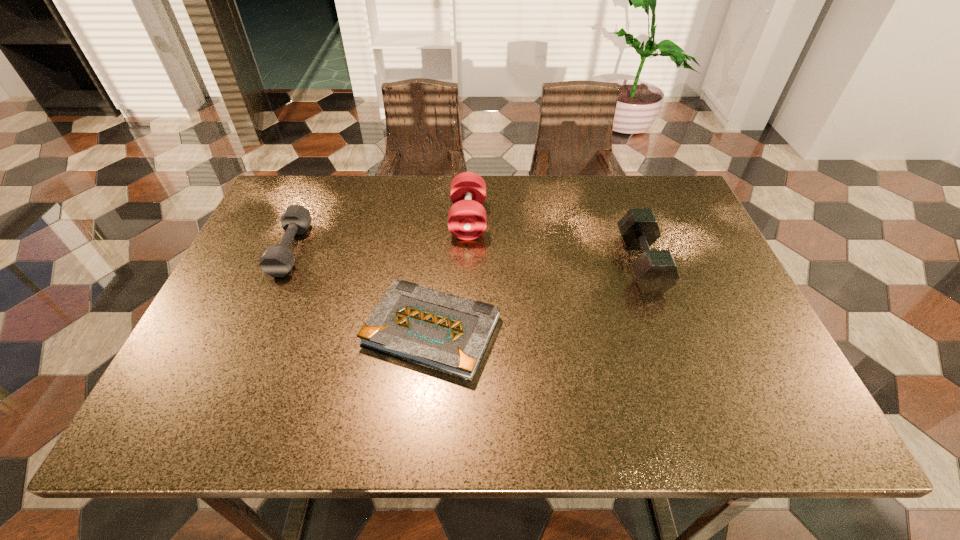
Find the location of a particular element. The image size is (960, 540). the second dumbbell from left to right is located at coordinates (467, 220).

Locate an element on the screen. the rightmost dumbbell is located at coordinates (656, 272).

What are the coordinates of `the leftmost object` in the screenshot? It's located at point(277,260).

Locate an element on the screen. The height and width of the screenshot is (540, 960). the shortest dumbbell is located at coordinates (277, 260).

You are a GUI agent. You are given a task and a screenshot of the screen. Output one action in this format:
    pyautogui.click(x=<x>, y=<y>)
    Task: Click on the shortest object
    
    Given the screenshot: What is the action you would take?
    pyautogui.click(x=448, y=333)

Locate an element on the screen. vacant space positioned on the right of the second dumbbell from left to right is located at coordinates (536, 220).

At what (x,y) coordinates should I click in order to perform the action: click on vacant space situated 0.310m on the left of the rightmost dumbbell. Please return your answer as a coordinate pair (x, y). Looking at the image, I should click on (500, 264).

I want to click on vacant point located on the right of the leftmost dumbbell, so click(354, 249).

Where is `free space located 0.280m on the back of the notebook`? The height and width of the screenshot is (540, 960). free space located 0.280m on the back of the notebook is located at coordinates (443, 215).

Where is `object present at the left edge`? The image size is (960, 540). object present at the left edge is located at coordinates pos(277,260).